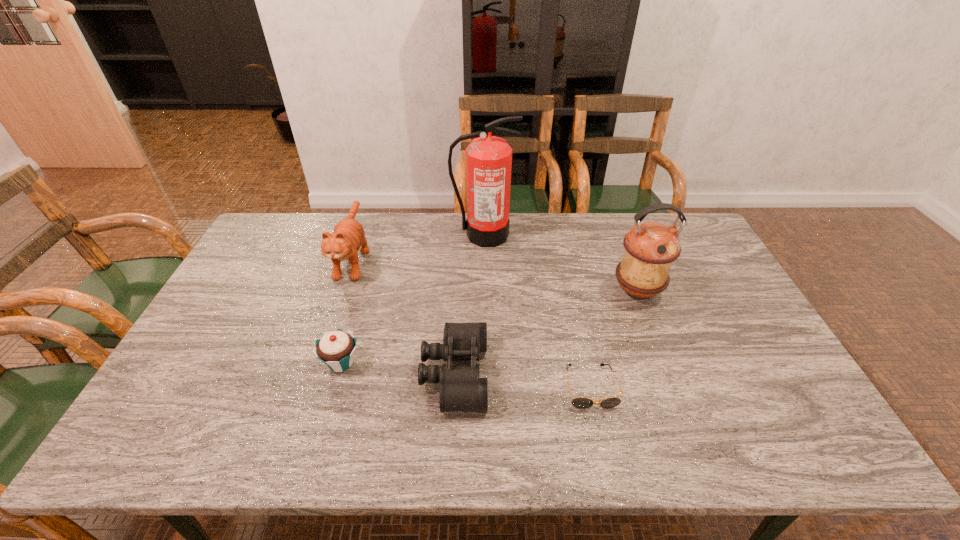
This screenshot has height=540, width=960. In order to click on object that can be found as the closest to the tallest object in this screenshot , I will do `click(348, 236)`.

Where is `vacant space that satisfies the following two spatial constraints: 1. on the front side of the fifth shortest object; 2. on the right side of the tallest object`? This screenshot has height=540, width=960. vacant space that satisfies the following two spatial constraints: 1. on the front side of the fifth shortest object; 2. on the right side of the tallest object is located at coordinates (484, 291).

You are a GUI agent. You are given a task and a screenshot of the screen. Output one action in this format:
    pyautogui.click(x=<x>, y=<y>)
    Task: Click on the vacant space that satisfies the following two spatial constraints: 1. on the face of the cat; 2. on the right side of the cupcake
    This screenshot has width=960, height=540.
    Given the screenshot: What is the action you would take?
    pyautogui.click(x=318, y=363)